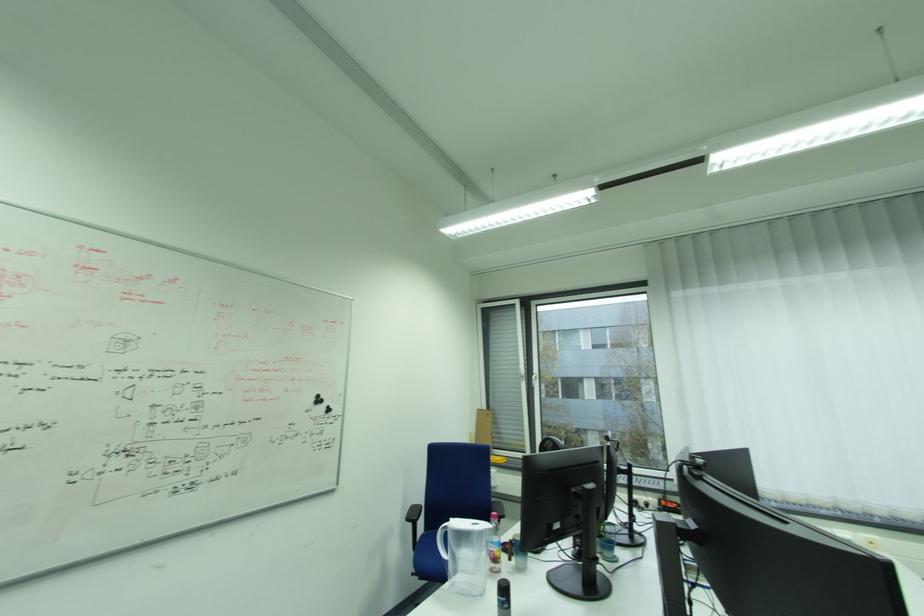
Image resolution: width=924 pixels, height=616 pixels. I want to click on white window handle, so click(x=520, y=374).